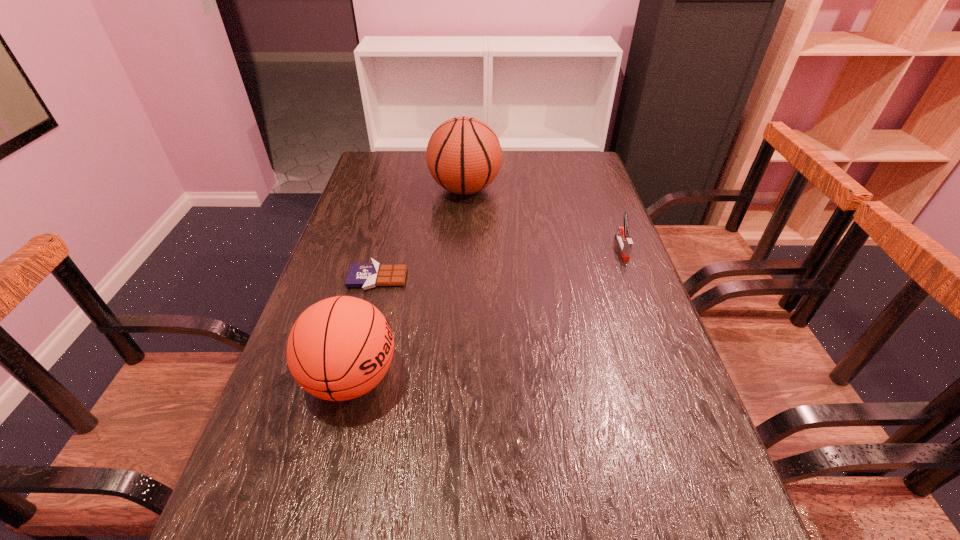
Find the location of a particular element. the farther basketball is located at coordinates (463, 155).

Identify the location of the taller basketball. (x=463, y=155).

At what (x,y) coordinates should I click in order to perform the action: click on the shorter basketball. Please return your answer as a coordinate pair (x, y). This screenshot has width=960, height=540. Looking at the image, I should click on (340, 348).

Identify the location of the second tallest object. (340, 348).

The image size is (960, 540). Identify the location of the third tallest object. (625, 243).

Find the location of a particular element. This screenshot has width=960, height=540. the rightmost object is located at coordinates (625, 243).

The height and width of the screenshot is (540, 960). What are the coordinates of `the shortest object` in the screenshot? It's located at (367, 276).

Where is `the second nearest object`? the second nearest object is located at coordinates (367, 276).

This screenshot has width=960, height=540. I want to click on vacant area situated 0.070m on the side where the inflation valve is located, so click(x=522, y=190).

Find the location of a particular element. This screenshot has width=960, height=540. vacant space located 0.380m on the side with logo of the nearer basketball is located at coordinates (585, 378).